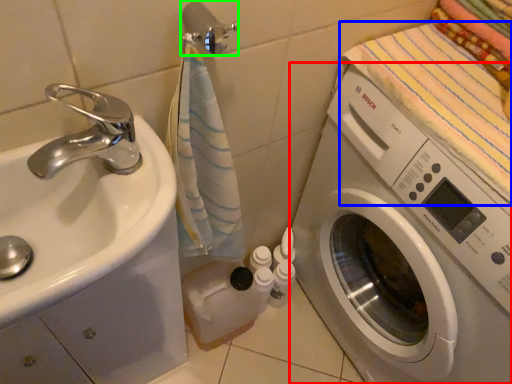
Question: Considering the real-world distances, which object is farthest from washing machine (highlighted by a red box)? beach towel (highlighted by a blue box) or towel bar (highlighted by a green box)?

Choices:
 (A) beach towel
 (B) towel bar

Answer: (B)